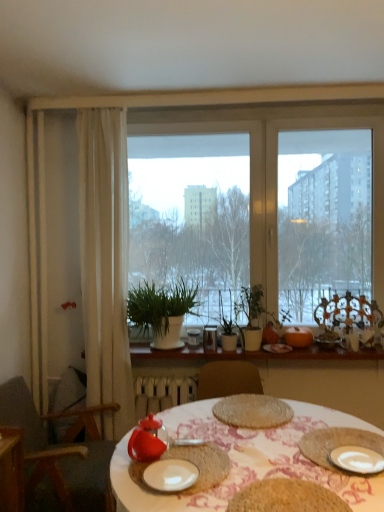
What are the coordinates of `blank space situated above white ceramic plate at lower right, the second plate from the left (from a real-world perspective)` in the screenshot? It's located at (362, 458).